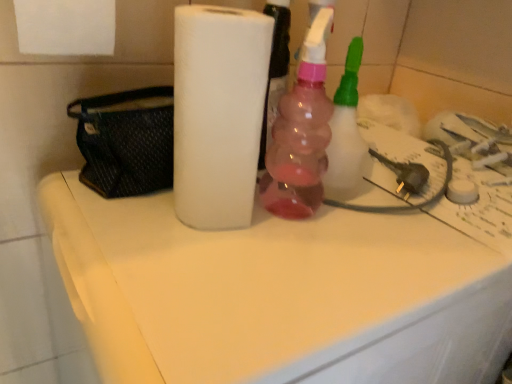
Question: From the image's perspective, would you say pink translucent bottle at center is shown under white matte paper towel at center?

Choices:
 (A) yes
 (B) no

Answer: (B)

Question: Is pink translucent bottle at center outside of white matte paper towel at center?

Choices:
 (A) no
 (B) yes

Answer: (B)

Question: From the image's perspective, is pink translucent bottle at center located above white matte paper towel at center?

Choices:
 (A) no
 (B) yes

Answer: (B)

Question: Is pink translucent bottle at center to the left of white matte paper towel at center from the viewer's perspective?

Choices:
 (A) yes
 (B) no

Answer: (B)

Question: Considering the relative positions of pink translucent bottle at center and white matte paper towel at center in the image provided, is pink translucent bottle at center to the right of white matte paper towel at center from the viewer's perspective?

Choices:
 (A) no
 (B) yes

Answer: (B)

Question: Considering the relative sizes of pink translucent bottle at center and white matte paper towel at center in the image provided, is pink translucent bottle at center thinner than white matte paper towel at center?

Choices:
 (A) no
 (B) yes

Answer: (B)

Question: Is white matte counter top at center far away from pink translucent bottle at center?

Choices:
 (A) no
 (B) yes

Answer: (A)

Question: Does white matte counter top at center lie behind pink translucent bottle at center?

Choices:
 (A) yes
 (B) no

Answer: (B)

Question: Is the position of white matte counter top at center less distant than that of pink translucent bottle at center?

Choices:
 (A) no
 (B) yes

Answer: (B)

Question: From a real-world perspective, is white matte counter top at center beneath pink translucent bottle at center?

Choices:
 (A) no
 (B) yes

Answer: (B)

Question: Is white matte counter top at center surrounding pink translucent bottle at center?

Choices:
 (A) no
 (B) yes

Answer: (A)

Question: Is white matte counter top at center at the left side of pink translucent bottle at center?

Choices:
 (A) yes
 (B) no

Answer: (A)

Question: Considering the relative positions of pink translucent bottle at center and white matte counter top at center in the image provided, is pink translucent bottle at center behind white matte counter top at center?

Choices:
 (A) yes
 (B) no

Answer: (A)